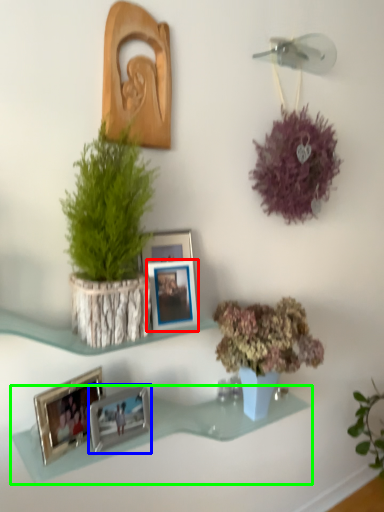
Question: Which object is positioned farthest from picture frame (highlighted by a red box)? Select from picture frame (highlighted by a blue box) and shelf (highlighted by a green box).

Choices:
 (A) picture frame
 (B) shelf

Answer: (B)